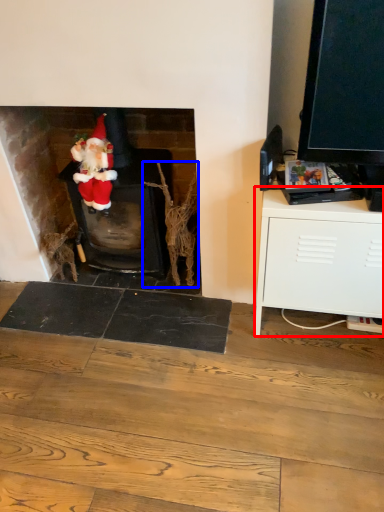
Question: Which point is further to the camera, cabinetry (highlighted by a red box) or branch (highlighted by a blue box)?

Choices:
 (A) cabinetry
 (B) branch

Answer: (B)